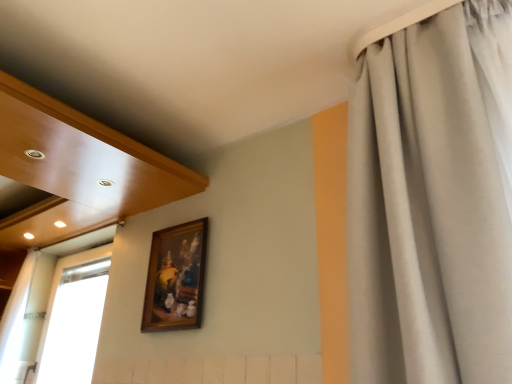
Locate an element on the screen. white sheer curtain at left, acting as the second curtain starting from the top is located at coordinates (15, 320).

Measure the distance between point [7,361] and camera.

They are 2.59 meters apart.

Locate an element on the screen. white sheer curtain at left, the 1th curtain positioned from the bottom is located at coordinates (15, 320).

From a real-world perspective, is white sheer curtain at left positioned under white sheer curtain at left, which is the second curtain in front-to-back order, based on gravity?

Yes, from a real-world perspective, white sheer curtain at left is below white sheer curtain at left, which is the second curtain in front-to-back order.

From the image's perspective, who appears lower, white sheer curtain at left or white sheer curtain at left, which is the 1th curtain from left to right?

white sheer curtain at left, which is the 1th curtain from left to right, is shown below in the image.

Is white sheer curtain at left positioned before white sheer curtain at left, acting as the second curtain starting from the top?

Yes, the depth of white sheer curtain at left is less than that of white sheer curtain at left, acting as the second curtain starting from the top.

Would you say white sheer curtain at left is outside white sheer curtain at left, acting as the second curtain starting from the top?

Yes.

Which is closer, (83, 339) or (197, 277)?

The point (197, 277) is closer to the camera.

Image resolution: width=512 pixels, height=384 pixels. Identify the location of picture frame positioned vertically above the white sheer curtain at left (from a real-world perspective). (176, 278).

Consider the image. Between white sheer curtain at left and wooden frame at upper center, which one has smaller size?

Smaller between the two is wooden frame at upper center.

How many degrees apart are the facing directions of white sheer curtain at left and wooden frame at upper center?

The angular difference between white sheer curtain at left and wooden frame at upper center is 0.245 degrees.

Is white sheer curtain at left facing away from satin gray curtain at right, the 2th curtain positioned from the back?

That's not correct — white sheer curtain at left is not looking away from satin gray curtain at right, the 2th curtain positioned from the back.

How different are the orientations of white sheer curtain at left and satin gray curtain at right, the 2th curtain positioned from the back, in degrees?

1.99 degrees separate the facing orientations of white sheer curtain at left and satin gray curtain at right, the 2th curtain positioned from the back.

Which is more to the left, white sheer curtain at left or satin gray curtain at right, which appears as the 1th curtain when viewed from the right?

white sheer curtain at left is more to the left.

Considering the relative sizes of white sheer curtain at left and satin gray curtain at right, the 2th curtain positioned from the left, in the image provided, is white sheer curtain at left taller than satin gray curtain at right, the 2th curtain positioned from the left,?

In fact, white sheer curtain at left may be shorter than satin gray curtain at right, the 2th curtain positioned from the left.

How much distance is there between satin gray curtain at right, the first curtain positioned from the front, and white sheer curtain at left?

A: 3.25 meters.

Is satin gray curtain at right, which ranks as the 2th curtain in bottom-to-top order, facing away from white sheer curtain at left?

No.

From the image's perspective, between satin gray curtain at right, the 2th curtain positioned from the back, and white sheer curtain at left, who is located below?

white sheer curtain at left.

From the picture: What's the angular difference between satin gray curtain at right, the first curtain positioned from the front, and white sheer curtain at left's facing directions?

1.99 degrees separate the facing orientations of satin gray curtain at right, the first curtain positioned from the front, and white sheer curtain at left.

Considering the positions of objects wooden frame at upper center and white sheer curtain at left in the image provided, who is in front, wooden frame at upper center or white sheer curtain at left?

Positioned in front is wooden frame at upper center.

Does wooden frame at upper center appear on the right side of white sheer curtain at left?

Indeed, wooden frame at upper center is positioned on the right side of white sheer curtain at left.

Is point (152, 252) in front of point (50, 347)?

That is True.

This screenshot has height=384, width=512. In order to click on picture frame above the white sheer curtain at left (from the image's perspective) in this screenshot , I will do `click(176, 278)`.

Find the location of `picture frame that is on the left side of satin gray curtain at right, which ranks as the 2th curtain in bottom-to-top order`. picture frame that is on the left side of satin gray curtain at right, which ranks as the 2th curtain in bottom-to-top order is located at coordinates point(176,278).

Which object is positioned more to the left, wooden frame at upper center or satin gray curtain at right, which ranks as the 2th curtain in bottom-to-top order?

wooden frame at upper center.

From the image's perspective, is wooden frame at upper center positioned above or below satin gray curtain at right, the 2th curtain positioned from the back?

wooden frame at upper center is below satin gray curtain at right, the 2th curtain positioned from the back.

Is wooden frame at upper center touching satin gray curtain at right, which ranks as the 2th curtain in bottom-to-top order?

They are not placed beside each other.

Is satin gray curtain at right, placed as the 1th curtain when sorted from top to bottom, placed right next to white sheer curtain at left, which is the second curtain in front-to-back order?

No, satin gray curtain at right, placed as the 1th curtain when sorted from top to bottom, is not with white sheer curtain at left, which is the second curtain in front-to-back order.

Can you confirm if satin gray curtain at right, which appears as the 1th curtain when viewed from the right, is shorter than white sheer curtain at left, acting as the second curtain starting from the top?

No.

From a real-world perspective, is satin gray curtain at right, which appears as the 1th curtain when viewed from the right, physically above white sheer curtain at left, which is the 1th curtain from left to right?

Indeed, from a real-world perspective, satin gray curtain at right, which appears as the 1th curtain when viewed from the right, stands above white sheer curtain at left, which is the 1th curtain from left to right.

Would you say satin gray curtain at right, the 2th curtain positioned from the back, is outside white sheer curtain at left, acting as the second curtain starting from the top?

Yes, satin gray curtain at right, the 2th curtain positioned from the back, is not within white sheer curtain at left, acting as the second curtain starting from the top.

In the image, there is a white sheer curtain at left, the second curtain positioned from the right. Where is `window above it (from the image's perspective)`? window above it (from the image's perspective) is located at coordinates (74, 318).

This screenshot has width=512, height=384. I want to click on picture frame in front of the white sheer curtain at left, so click(x=176, y=278).

From the image, which object appears to be farther from satin gray curtain at right, the 2th curtain positioned from the back, white sheer curtain at left, the 1th curtain positioned from the bottom, or wooden frame at upper center?

Among the two, white sheer curtain at left, the 1th curtain positioned from the bottom, is located further to satin gray curtain at right, the 2th curtain positioned from the back.

When comparing their distances from white sheer curtain at left, does satin gray curtain at right, placed as the 1th curtain when sorted from top to bottom, or white sheer curtain at left, which is the 1th curtain from left to right, seem further?

satin gray curtain at right, placed as the 1th curtain when sorted from top to bottom, is further to white sheer curtain at left.

From the image, which object appears to be nearer to wooden frame at upper center, white sheer curtain at left, which is the second curtain in front-to-back order, or white sheer curtain at left?

Based on the image, white sheer curtain at left, which is the second curtain in front-to-back order, appears to be nearer to wooden frame at upper center.

Looking at the image, which one is located further to satin gray curtain at right, the 2th curtain positioned from the left, wooden frame at upper center or white sheer curtain at left, the second curtain positioned from the right?

Among the two, white sheer curtain at left, the second curtain positioned from the right, is located further to satin gray curtain at right, the 2th curtain positioned from the left.

Which object lies nearer to the anchor point white sheer curtain at left, white sheer curtain at left, which is the 1th curtain from left to right, or wooden frame at upper center?

Among the two, white sheer curtain at left, which is the 1th curtain from left to right, is located nearer to white sheer curtain at left.

Estimate the real-world distances between objects in this image. Which object is closer to white sheer curtain at left, acting as the second curtain starting from the top, satin gray curtain at right, the 2th curtain positioned from the left, or white sheer curtain at left?

white sheer curtain at left is positioned closer to the anchor white sheer curtain at left, acting as the second curtain starting from the top.

Based on their spatial positions, is white sheer curtain at left or white sheer curtain at left, which is the 1th curtain from left to right, further from satin gray curtain at right, which ranks as the 2th curtain in bottom-to-top order?

white sheer curtain at left.

Considering their positions, is satin gray curtain at right, the 2th curtain positioned from the back, positioned closer to wooden frame at upper center than white sheer curtain at left?

The object closer to wooden frame at upper center is satin gray curtain at right, the 2th curtain positioned from the back.

Locate an element on the screen. The width and height of the screenshot is (512, 384). picture frame between white sheer curtain at left, the 1th curtain viewed from the back, and satin gray curtain at right, the first curtain positioned from the front, from left to right is located at coordinates (176, 278).

Locate an element on the screen. This screenshot has width=512, height=384. picture frame between satin gray curtain at right, which ranks as the 2th curtain in bottom-to-top order, and white sheer curtain at left from front to back is located at coordinates (176, 278).

Locate an element on the screen. This screenshot has width=512, height=384. window between white sheer curtain at left, the second curtain positioned from the right, and wooden frame at upper center, in the horizontal direction is located at coordinates (74, 318).

This screenshot has width=512, height=384. Identify the location of window positioned between satin gray curtain at right, which appears as the 1th curtain when viewed from the right, and white sheer curtain at left, the second curtain positioned from the right, from near to far. (74, 318).